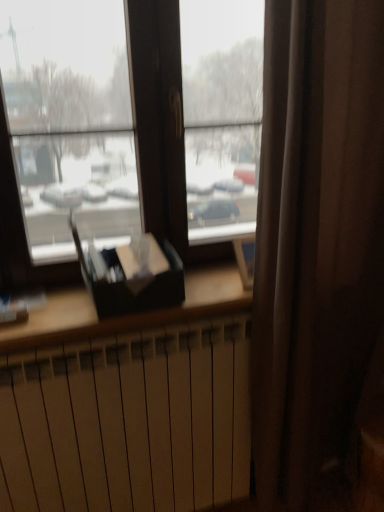
Question: Considering the positions of matte black book at center and white matte radiator at lower center in the image, is matte black book at center bigger or smaller than white matte radiator at lower center?

Choices:
 (A) small
 (B) big

Answer: (A)

Question: Considering the positions of matte black book at center and white matte radiator at lower center in the image, is matte black book at center taller or shorter than white matte radiator at lower center?

Choices:
 (A) short
 (B) tall

Answer: (A)

Question: Considering the positions of point (142, 263) and point (112, 467), is point (142, 263) closer or farther from the camera than point (112, 467)?

Choices:
 (A) closer
 (B) farther

Answer: (A)

Question: Do you think white matte radiator at lower center is within matte black book at center, or outside of it?

Choices:
 (A) inside
 (B) outside

Answer: (B)

Question: Looking at the image, does white matte radiator at lower center seem bigger or smaller compared to matte black book at center?

Choices:
 (A) small
 (B) big

Answer: (B)

Question: Based on their positions, is white matte radiator at lower center located to the left or right of matte black book at center?

Choices:
 (A) left
 (B) right

Answer: (B)

Question: Considering their positions, is white matte radiator at lower center located in front of or behind matte black book at center?

Choices:
 (A) front
 (B) behind

Answer: (A)